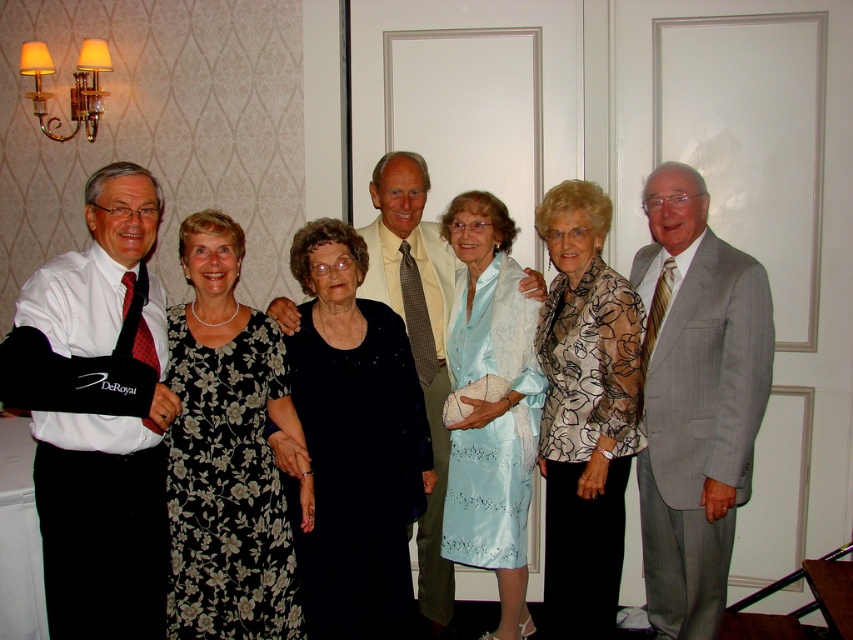
Question: Is black floral dress at center wider than printed silk blouse at center?

Choices:
 (A) no
 (B) yes

Answer: (B)

Question: Which of the following is the farthest from the observer?

Choices:
 (A) (561, 600)
 (B) (375, 358)
 (C) (730, 424)
 (D) (467, 308)

Answer: (D)

Question: Considering the relative positions of black satin dress at center and white satin dress at center in the image provided, where is black satin dress at center located with respect to white satin dress at center?

Choices:
 (A) above
 (B) below

Answer: (A)

Question: Is black floral dress at center closer to camera compared to printed silk blouse at center?

Choices:
 (A) no
 (B) yes

Answer: (B)

Question: Among these points, which one is farthest from the camera?

Choices:
 (A) (453, 440)
 (B) (271, 465)
 (C) (361, 582)

Answer: (A)

Question: Which point is farther to the camera?

Choices:
 (A) (518, 458)
 (B) (61, 300)
 (C) (328, 525)
 (D) (13, 544)

Answer: (A)